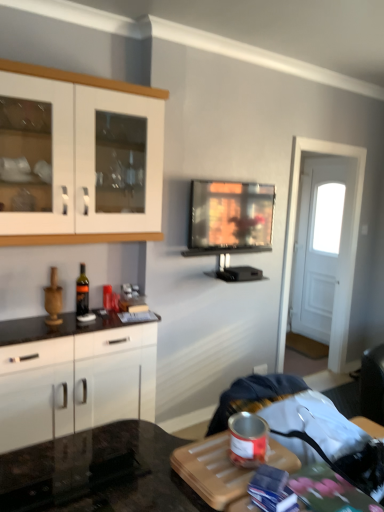
Question: Considering the relative positions of white wooden door at right and flat screen tv at center in the image provided, is white wooden door at right to the right of flat screen tv at center from the viewer's perspective?

Choices:
 (A) yes
 (B) no

Answer: (A)

Question: Does white wooden door at right have a larger size compared to flat screen tv at center?

Choices:
 (A) no
 (B) yes

Answer: (B)

Question: From the image's perspective, is white wooden door at right beneath flat screen tv at center?

Choices:
 (A) yes
 (B) no

Answer: (A)

Question: Considering the relative sizes of white wooden door at right and flat screen tv at center in the image provided, is white wooden door at right shorter than flat screen tv at center?

Choices:
 (A) no
 (B) yes

Answer: (A)

Question: Is white wooden door at right far from flat screen tv at center?

Choices:
 (A) no
 (B) yes

Answer: (B)

Question: In terms of width, does white glossy cabinet at upper left, the first cabinetry positioned from the top, look wider or thinner when compared to white glossy cabinet at left, which ranks as the 1th cabinetry in bottom-to-top order?

Choices:
 (A) wide
 (B) thin

Answer: (B)

Question: Is white glossy cabinet at upper left, marked as the 2th cabinetry in a bottom-to-top arrangement, inside or outside of white glossy cabinet at left, marked as the 2th cabinetry in a top-to-bottom arrangement?

Choices:
 (A) outside
 (B) inside

Answer: (A)

Question: Does point (132, 232) appear closer or farther from the camera than point (11, 422)?

Choices:
 (A) farther
 (B) closer

Answer: (A)

Question: Visually, is white glossy cabinet at upper left, marked as the 2th cabinetry in a bottom-to-top arrangement, positioned to the left or to the right of white glossy cabinet at left, which ranks as the 1th cabinetry in bottom-to-top order?

Choices:
 (A) right
 (B) left

Answer: (A)

Question: Is white glossy cabinet at left, marked as the 2th cabinetry in a top-to-bottom arrangement, wider or thinner than white wooden door at right?

Choices:
 (A) thin
 (B) wide

Answer: (B)

Question: Based on their positions, is white glossy cabinet at left, which ranks as the 1th cabinetry in bottom-to-top order, located to the left or right of white wooden door at right?

Choices:
 (A) right
 (B) left

Answer: (B)

Question: Is point [1, 415] positioned closer to the camera than point [306, 199]?

Choices:
 (A) farther
 (B) closer

Answer: (B)

Question: Do you think white glossy cabinet at left, which ranks as the 1th cabinetry in bottom-to-top order, is within white wooden door at right, or outside of it?

Choices:
 (A) outside
 (B) inside

Answer: (A)

Question: Based on their sizes in the image, would you say white wooden door at right is bigger or smaller than white glossy cabinet at left, marked as the 2th cabinetry in a top-to-bottom arrangement?

Choices:
 (A) big
 (B) small

Answer: (B)

Question: Considering the positions of white wooden door at right and white glossy cabinet at left, marked as the 2th cabinetry in a top-to-bottom arrangement, in the image, is white wooden door at right wider or thinner than white glossy cabinet at left, marked as the 2th cabinetry in a top-to-bottom arrangement,?

Choices:
 (A) wide
 (B) thin

Answer: (B)